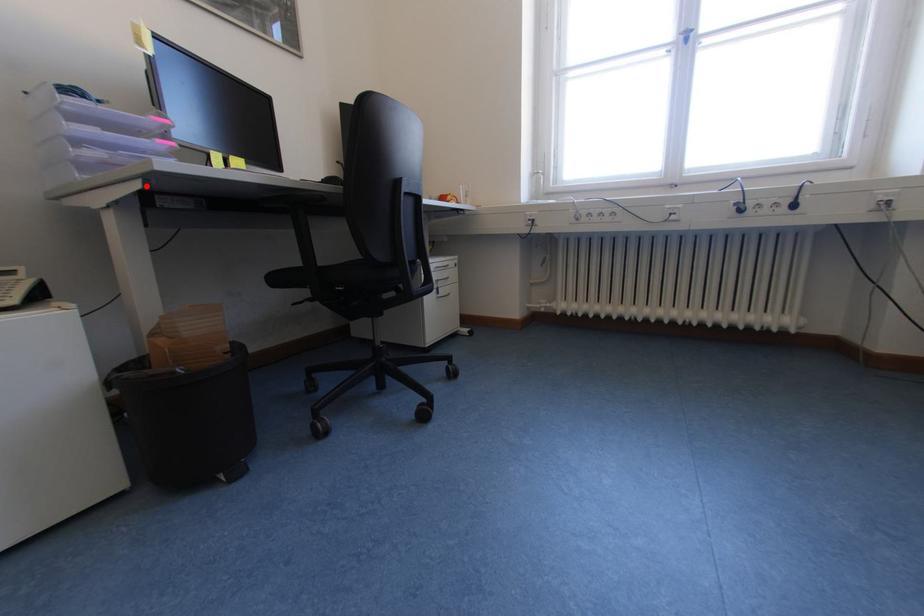
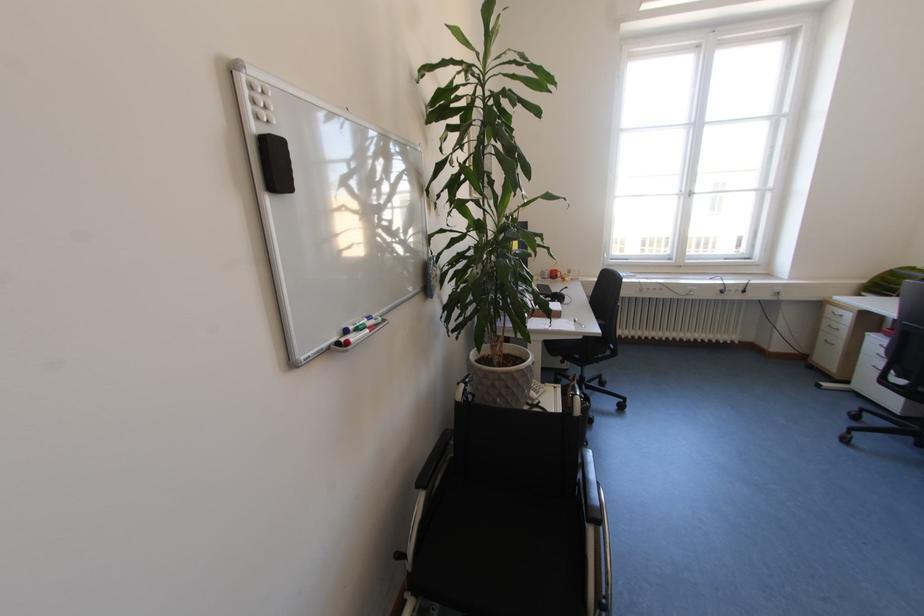
Find the pixel in the second image that matches the highlighted location in the first image.

(589, 339)